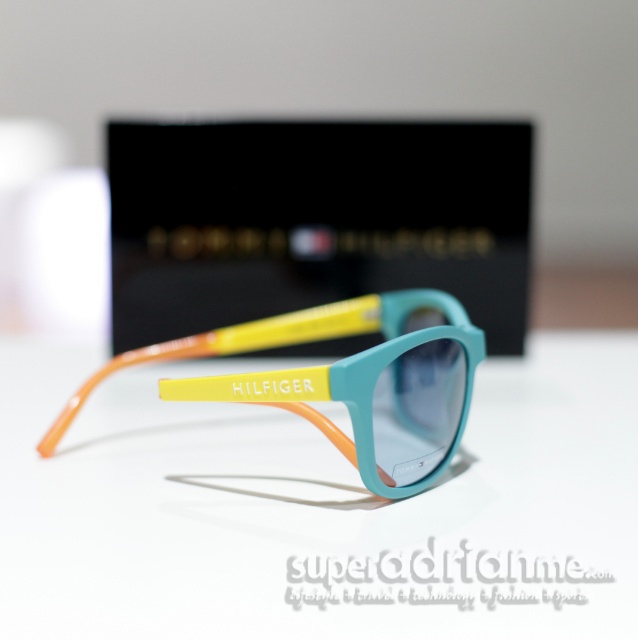
Between point (538, 577) and point (170, 300), which one is positioned behind?

Positioned behind is point (170, 300).

Who is higher up, white matte table at center or matte black box at upper center?

matte black box at upper center is above.

Who is more forward, (531, 394) or (360, 212)?

Point (531, 394) is more forward.

Image resolution: width=638 pixels, height=640 pixels. What are the coordinates of `white matte table at center` in the screenshot? It's located at (319, 508).

Who is lower down, matte black box at upper center or translucent orange and yellow plastic sunglasses at center?

Positioned lower is translucent orange and yellow plastic sunglasses at center.

Does point (480, 125) come farther from viewer compared to point (346, 451)?

Yes, it is behind point (346, 451).

Find the location of `matte black box at upper center`. matte black box at upper center is located at coordinates (315, 220).

Who is more distant from viewer, (x=24, y=561) or (x=343, y=365)?

The point (x=343, y=365) is more distant.

Between point (188, 465) and point (186, 397), which one is positioned in front?

Point (186, 397) is in front.

Does point (574, 570) come behind point (82, 396)?

No, (574, 570) is closer to viewer.

Identify the location of white matte table at center. The image size is (638, 640). (319, 508).